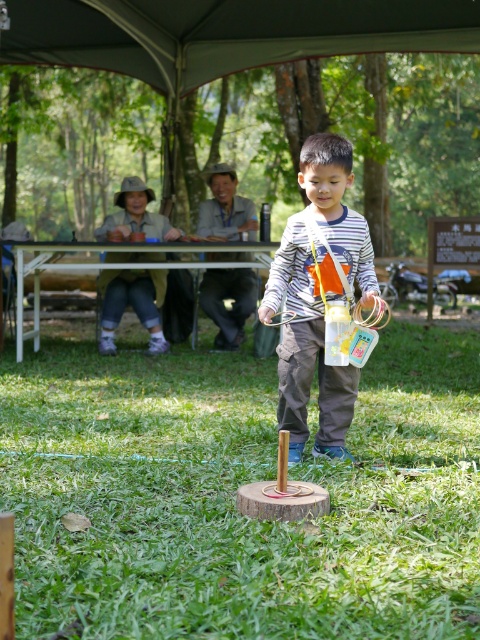
Does green grass at center have a greater width compared to white plastic picnic table at upper center?

No, green grass at center is not wider than white plastic picnic table at upper center.

Between point (121, 532) and point (17, 324), which one is positioned in front?

Positioned in front is point (121, 532).

You are a GUI agent. You are given a task and a screenshot of the screen. Output one action in this format:
    pyautogui.click(x=<x>, y=<y>)
    Task: Click on the green grass at center
    
    Given the screenshot: What is the action you would take?
    pyautogui.click(x=235, y=493)

Is green grass at center closer to camera compared to striped fabric shirt at center?

Yes, green grass at center is in front of striped fabric shirt at center.

Is green grass at center to the right of striped fabric shirt at center from the viewer's perspective?

No, green grass at center is not to the right of striped fabric shirt at center.

I want to click on green grass at center, so click(235, 493).

Image resolution: width=480 pixels, height=640 pixels. Find the location of `green grass at center`. green grass at center is located at coordinates (235, 493).

Can you confirm if striped fabric shirt at center is positioned to the left of white plastic picnic table at upper center?

Incorrect, striped fabric shirt at center is not on the left side of white plastic picnic table at upper center.

Which of these two, striped fabric shirt at center or white plastic picnic table at upper center, stands shorter?

white plastic picnic table at upper center is shorter.

Identify the location of striped fabric shirt at center. The height and width of the screenshot is (640, 480). (317, 296).